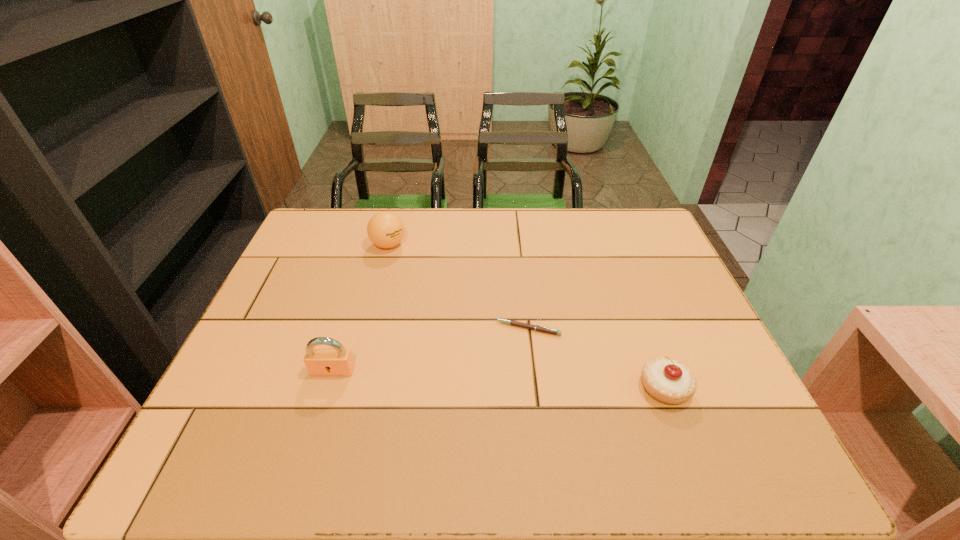
Locate an element on the screen. The image size is (960, 540). free spot between the second shortest object and the farthest object is located at coordinates (526, 316).

Find the location of a particular element. The width and height of the screenshot is (960, 540). vacant area that lies between the second object from right to left and the ping-pong ball is located at coordinates pos(458,287).

Find the location of `vacant space in between the ping-pong ball and the third nearest object`. vacant space in between the ping-pong ball and the third nearest object is located at coordinates (458, 287).

At what (x,y) coordinates should I click in order to perform the action: click on vacant space that's between the farthest object and the third tallest object. Please return your answer as a coordinate pair (x, y). Image resolution: width=960 pixels, height=540 pixels. Looking at the image, I should click on (526, 316).

This screenshot has width=960, height=540. I want to click on free space between the farthest object and the pen, so click(x=458, y=287).

What are the coordinates of `object that stands as the closest to the padlock` in the screenshot? It's located at (538, 328).

Choose which object is the third nearest neighbor to the third object from left to right. Please provide its 2D coordinates. Your answer should be formatted as a tuple, i.e. [(x, y)], where the tuple contains the x and y coordinates of a point satisfying the conditions above.

[(385, 229)]

Locate an element on the screen. vacant region that satisfies the following two spatial constraints: 1. to unlock the pastry from the front; 2. on the left side of the padlock is located at coordinates (327, 388).

Locate an element on the screen. The width and height of the screenshot is (960, 540). free point that satisfies the following two spatial constraints: 1. on the front side of the pen; 2. on the right side of the pastry is located at coordinates (534, 388).

Where is `vacant position in the image that satisfies the following two spatial constraints: 1. to unlock the pastry from the front; 2. on the left side of the padlock`? The image size is (960, 540). vacant position in the image that satisfies the following two spatial constraints: 1. to unlock the pastry from the front; 2. on the left side of the padlock is located at coordinates (327, 388).